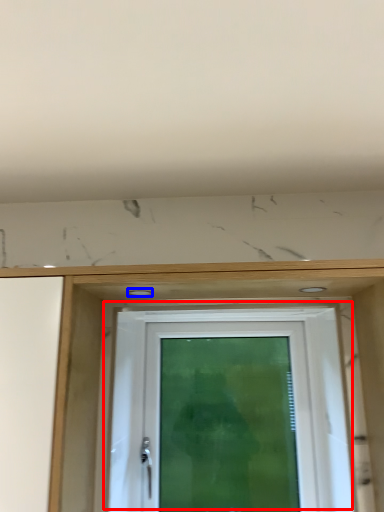
Question: Which of the following is the farthest to the observer, door (highlighted by a red box) or hole (highlighted by a blue box)?

Choices:
 (A) door
 (B) hole

Answer: (A)